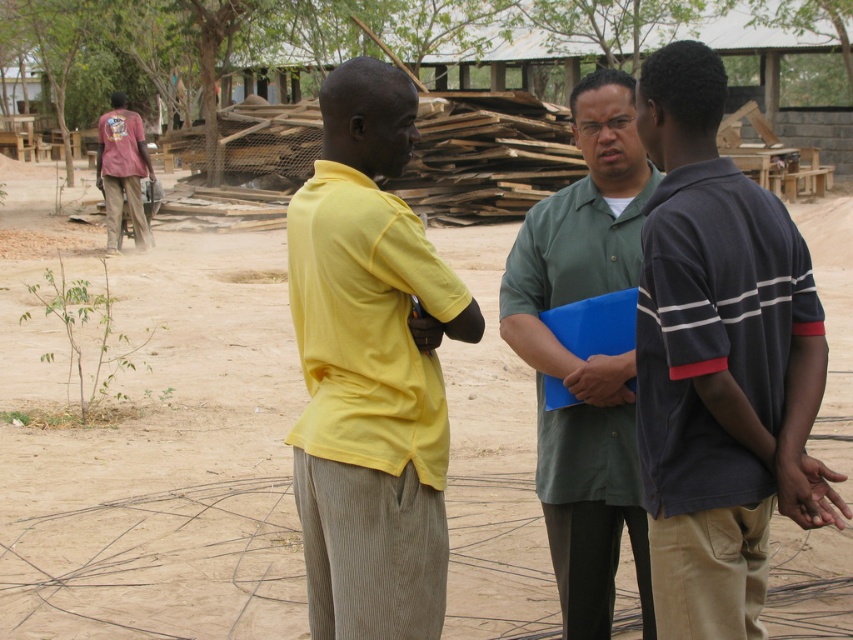
Question: Does dark blue striped polo shirt at right have a smaller size compared to green matte shirt at center?

Choices:
 (A) no
 (B) yes

Answer: (A)

Question: Which object is positioned closest to the brushed metal shirt at left?

Choices:
 (A) yellow cotton shirt at center
 (B) green matte shirt at center
 (C) dark blue striped polo shirt at right

Answer: (B)

Question: Among these objects, which one is farthest from the camera?

Choices:
 (A) green matte shirt at center
 (B) brushed metal shirt at left
 (C) yellow cotton shirt at center
 (D) dark blue striped polo shirt at right

Answer: (B)

Question: From the image, what is the correct spatial relationship of dark blue striped polo shirt at right in relation to yellow cotton shirt at center?

Choices:
 (A) below
 (B) above

Answer: (A)

Question: Is yellow cotton shirt at center to the right of green matte shirt at center from the viewer's perspective?

Choices:
 (A) no
 (B) yes

Answer: (A)

Question: Among these points, which one is farthest from the camera?

Choices:
 (A) (830, 474)
 (B) (558, 570)

Answer: (B)